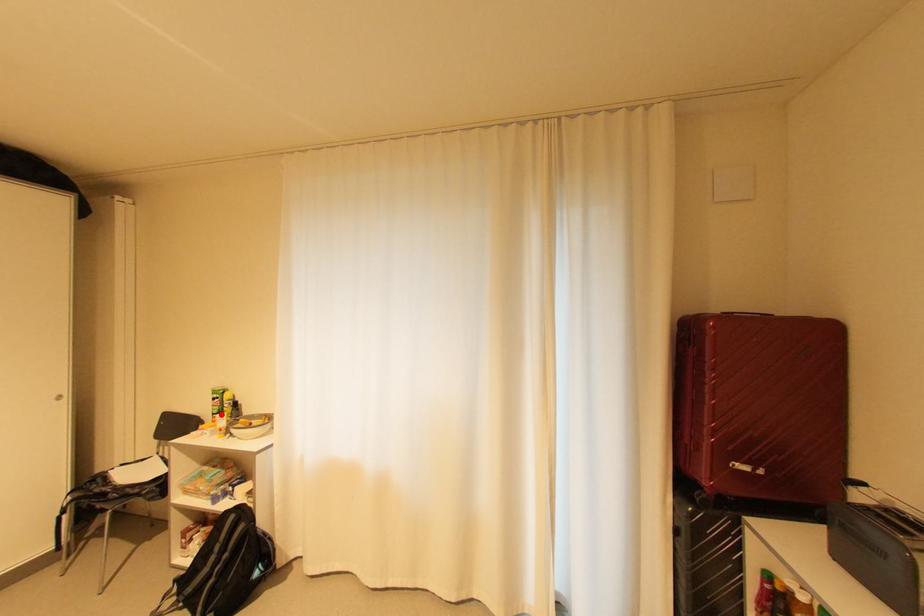
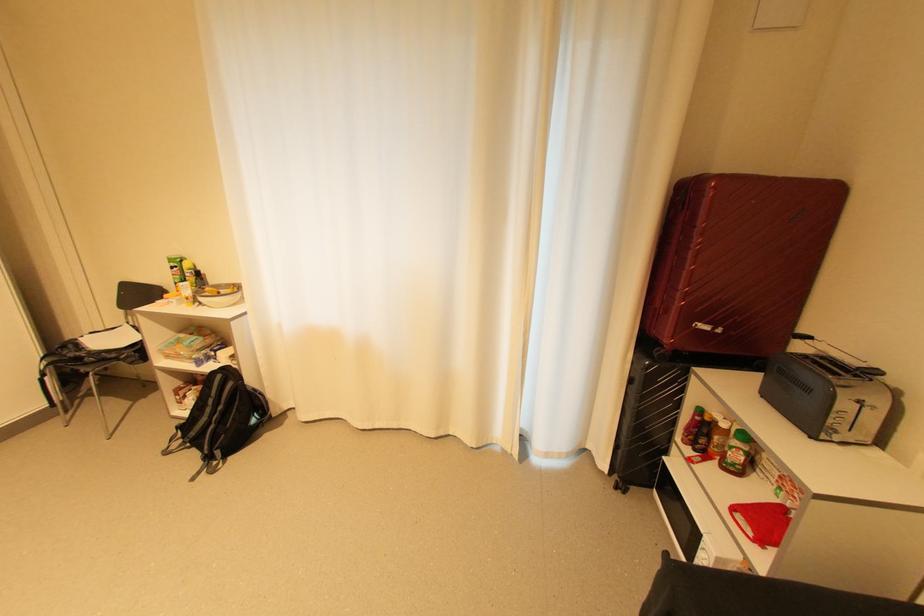
In the second image, find the point that corresponds to the highlighted location in the first image.

(185, 284)